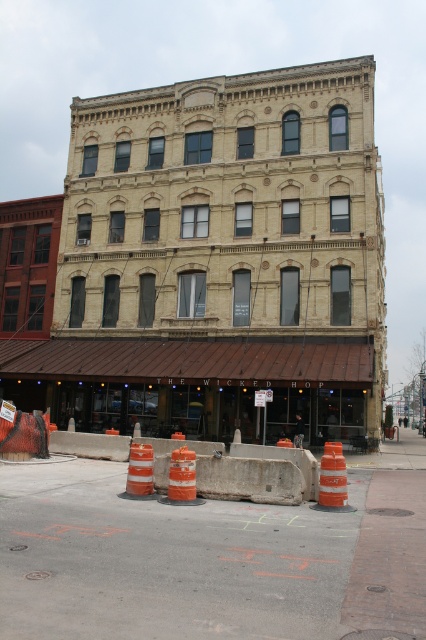
You are a delivery person trying to navigate a narrow pathway between the orange traffic cones at center and the concrete at center. The pathway is only 1 meter wide. Can your delivery cart, which is 0.8 meters wide, fit through this space?

The orange traffic cones at center might be wider than concrete at center, but since the pathway is 1 meter wide and the cart is 0.8 meters wide, there should be enough space for the cart to pass through as long as the cones and concrete don not block the entire width.

You are a delivery person approaching the building and need to deliver a package to the ground floor business. There are two orange traffic cones at center and an orange reflective cone at center in front of the entrance. Which cone is closer to the right side of the entrance?

The orange traffic cones at center is to the right of orange reflective cone at center, so the orange traffic cones at center is closer to the right side of the entrance.